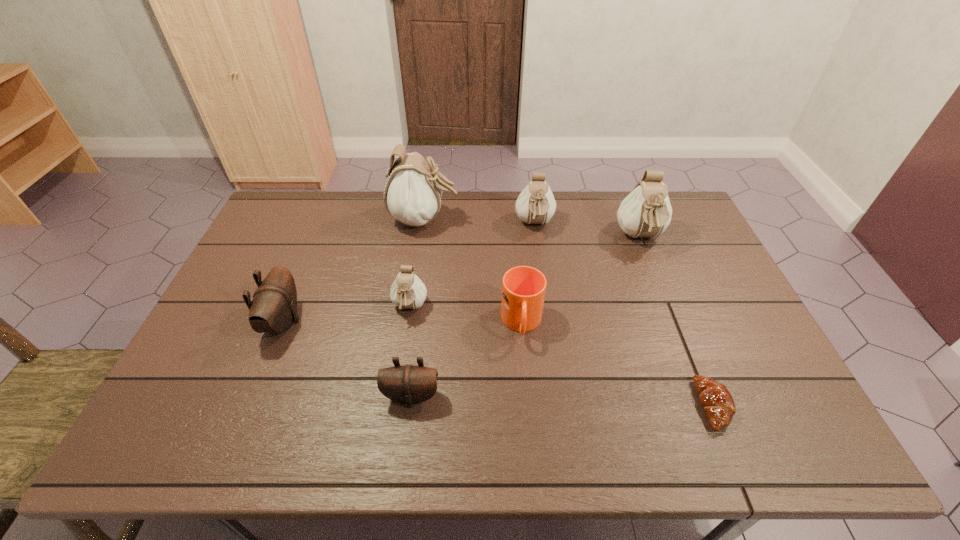
This screenshot has height=540, width=960. In order to click on object that is the sixth closest to the left brown pouch in this screenshot , I will do `click(646, 212)`.

You are a GUI agent. You are given a task and a screenshot of the screen. Output one action in this format:
    pyautogui.click(x=<x>, y=<y>)
    Task: Click on the object that stands as the fifth closest to the orange mug
    This screenshot has width=960, height=540.
    Given the screenshot: What is the action you would take?
    pyautogui.click(x=646, y=212)

Identify which pouch is located as the third nearest to the second biggest white pouch. Please provide its 2D coordinates. Your answer should be formatted as a tuple, i.e. [(x, y)], where the tuple contains the x and y coordinates of a point satisfying the conditions above.

[(407, 291)]

Choose which pouch is the nearest neighbor to the tallest pouch. Please provide its 2D coordinates. Your answer should be formatted as a tuple, i.e. [(x, y)], where the tuple contains the x and y coordinates of a point satisfying the conditions above.

[(535, 205)]

This screenshot has height=540, width=960. Find the location of `the third closest white pouch relative to the shortest object`. the third closest white pouch relative to the shortest object is located at coordinates (407, 291).

Select which white pouch is the closest to the tallest object. Please provide its 2D coordinates. Your answer should be formatted as a tuple, i.e. [(x, y)], where the tuple contains the x and y coordinates of a point satisfying the conditions above.

[(535, 205)]

You are a GUI agent. You are given a task and a screenshot of the screen. Output one action in this format:
    pyautogui.click(x=<x>, y=<y>)
    Task: Click on the free point that satisfies the following two spatial constraints: 1. on the front-facing side of the tallest object; 2. on the front-facing side of the smallest white pouch
    
    Given the screenshot: What is the action you would take?
    pyautogui.click(x=412, y=308)

Find the location of `blank area in the image that satisfies the following two spatial constraints: 1. on the handle side of the brown crescent roll; 2. on the right side of the mug`. blank area in the image that satisfies the following two spatial constraints: 1. on the handle side of the brown crescent roll; 2. on the right side of the mug is located at coordinates pos(529,405).

Identify the location of vacant space that satisfies the following two spatial constraints: 1. on the front-facing side of the second tallest pouch; 2. on the left side of the shortest object. This screenshot has height=540, width=960. (707, 405).

Identify the location of vacant space that satisfies the following two spatial constraints: 1. on the front-facing side of the tallest object; 2. on the right side of the brown crescent roll. (397, 405).